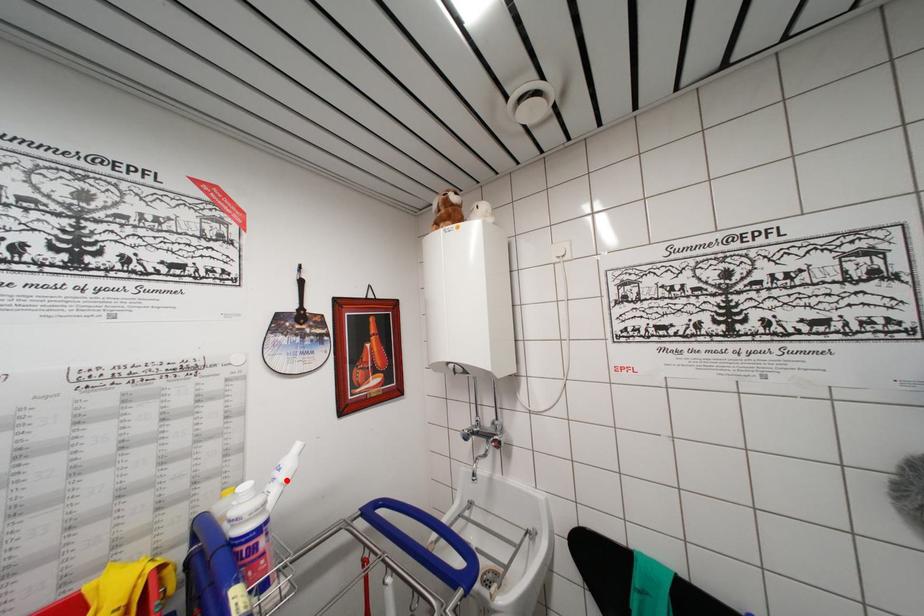
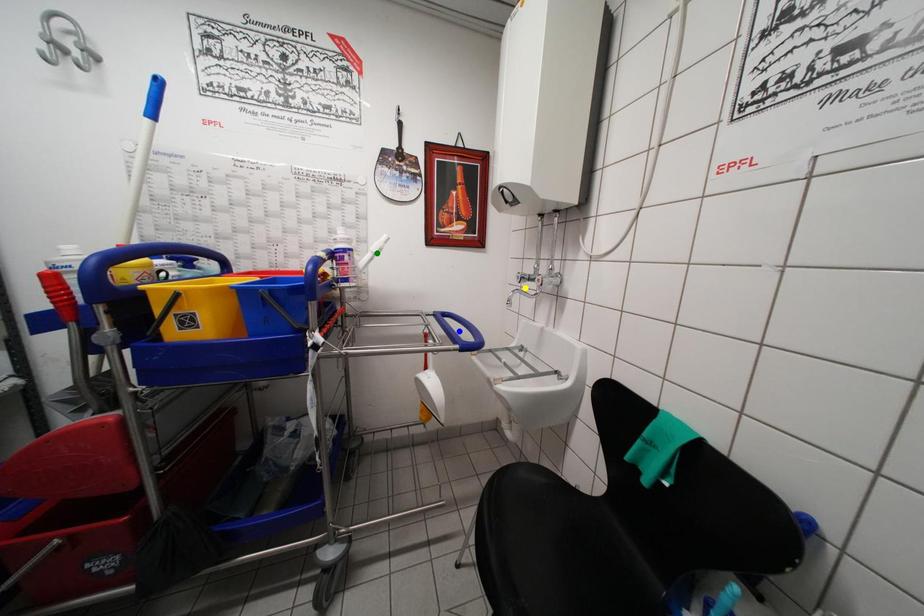
Question: I am providing you with two images of the same scene from different viewpoints. A red point is marked on the first image. You are given multiple points on the second image. Which point in image 2 represents the same 3d spot as the red point in image 1?

Choices:
 (A) yellow point
 (B) green point
 (C) blue point

Answer: (B)